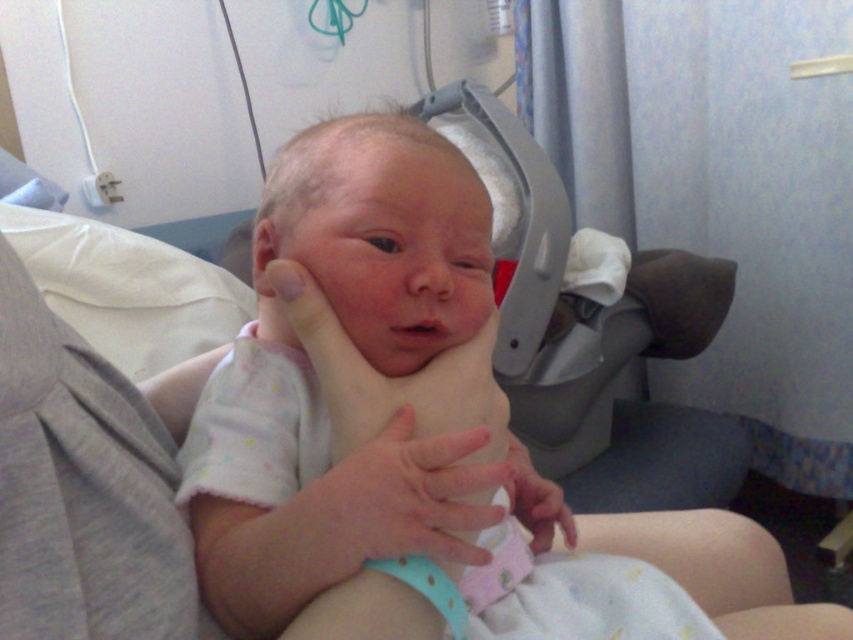
What is the location of the point with coordinates (310, 371) in the hospital room scene?

The point with coordinates (310, 371) is located on the white cotton newborn at center.

Based on the photo, what is the color of the object located at point (405, 497) in the hospital room scene?

The object at point (405, 497) is pink fabric hand.

You are a nurse in a hospital. You need to place a medical device on the white cotton newborn at center. Where exactly should you place it?

The medical device should be placed at the position of the white cotton newborn at center, which is located at point (310, 371).